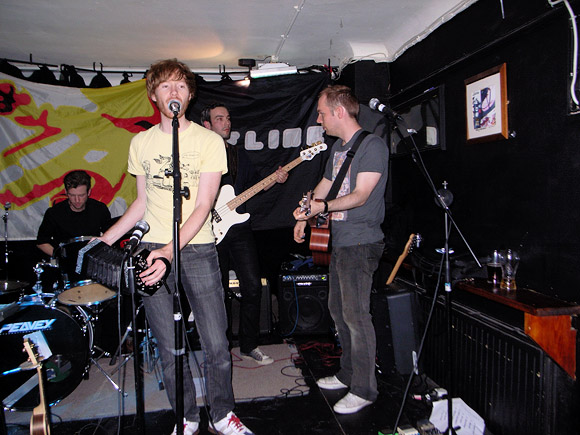
Locate an element on the screen. The width and height of the screenshot is (580, 435). frame is located at coordinates tap(466, 109).